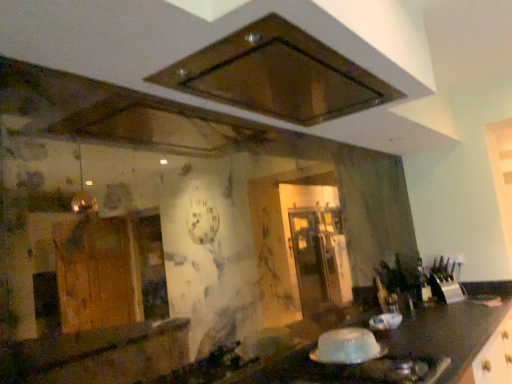
Question: Is metallic silver knife block at right located within white glossy gas stove at lower right?

Choices:
 (A) yes
 (B) no

Answer: (B)

Question: Is white glossy gas stove at lower right thinner than metallic silver knife block at right?

Choices:
 (A) yes
 (B) no

Answer: (B)

Question: Considering the relative sizes of white glossy gas stove at lower right and metallic silver knife block at right in the image provided, is white glossy gas stove at lower right shorter than metallic silver knife block at right?

Choices:
 (A) no
 (B) yes

Answer: (B)

Question: Is the surface of white glossy gas stove at lower right in direct contact with metallic silver knife block at right?

Choices:
 (A) yes
 (B) no

Answer: (B)

Question: Is white glossy gas stove at lower right facing away from metallic silver knife block at right?

Choices:
 (A) yes
 (B) no

Answer: (B)

Question: Is white glossy gas stove at lower right located outside metallic silver knife block at right?

Choices:
 (A) yes
 (B) no

Answer: (A)

Question: From a real-world perspective, is brown matte exhaust hood at upper center on top of metallic silver knife block at right?

Choices:
 (A) yes
 (B) no

Answer: (A)

Question: From the image's perspective, is brown matte exhaust hood at upper center over metallic silver knife block at right?

Choices:
 (A) no
 (B) yes

Answer: (B)

Question: Does brown matte exhaust hood at upper center lie in front of metallic silver knife block at right?

Choices:
 (A) no
 (B) yes

Answer: (B)

Question: Is brown matte exhaust hood at upper center to the left of metallic silver knife block at right from the viewer's perspective?

Choices:
 (A) no
 (B) yes

Answer: (B)

Question: Is metallic silver knife block at right a part of brown matte exhaust hood at upper center?

Choices:
 (A) yes
 (B) no

Answer: (B)

Question: Is brown matte exhaust hood at upper center shorter than metallic silver knife block at right?

Choices:
 (A) yes
 (B) no

Answer: (A)

Question: From a real-world perspective, is translucent plastic container at lower center on top of brown matte exhaust hood at upper center?

Choices:
 (A) yes
 (B) no

Answer: (B)